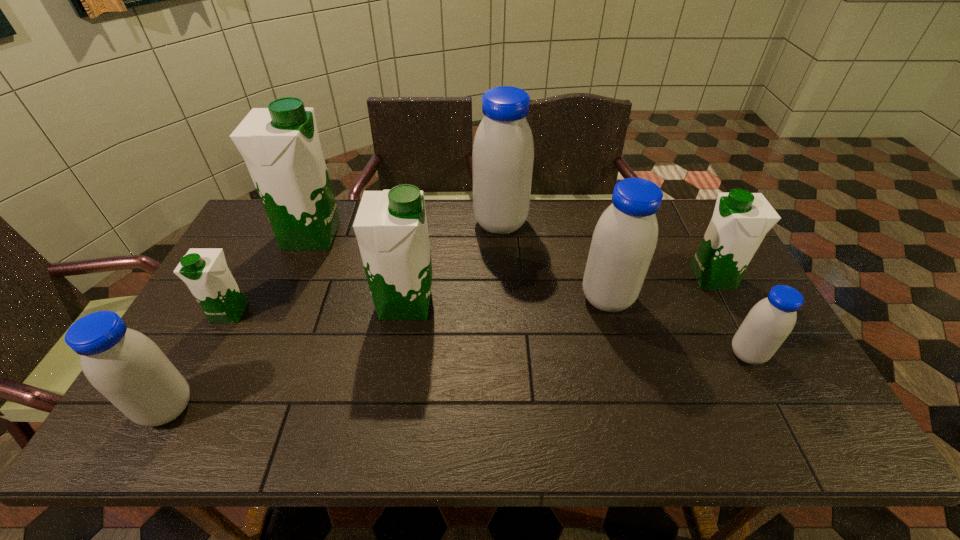
You are a GUI agent. You are given a task and a screenshot of the screen. Output one action in this format:
    pyautogui.click(x=<x>, y=<y>)
    Task: Click on the vacant space situated on the back of the nearest soya milk
    The height and width of the screenshot is (540, 960).
    Given the screenshot: What is the action you would take?
    pyautogui.click(x=221, y=310)

Locate an element on the screen. blank space located on the front-facing side of the smallest green soya milk is located at coordinates (194, 381).

Find the location of a particular element. The height and width of the screenshot is (540, 960). free space located on the back of the smallest blue soya milk is located at coordinates (710, 282).

Identify the location of object that is at the near edge. (125, 366).

Where is `object located at the far left corner`? The image size is (960, 540). object located at the far left corner is located at coordinates (280, 145).

Locate an element on the screen. object present at the near left corner is located at coordinates (125, 366).

This screenshot has height=540, width=960. In the image, there is a desktop. In order to click on vacant space at the far edge in this screenshot , I will do `click(428, 226)`.

At what (x,y) coordinates should I click in order to perform the action: click on vacant area at the near edge. Please return your answer as a coordinate pair (x, y). Looking at the image, I should click on (338, 441).

This screenshot has width=960, height=540. I want to click on free location at the left edge of the desktop, so click(x=244, y=245).

The width and height of the screenshot is (960, 540). Identify the location of vacant space at the right edge of the desktop. (791, 408).